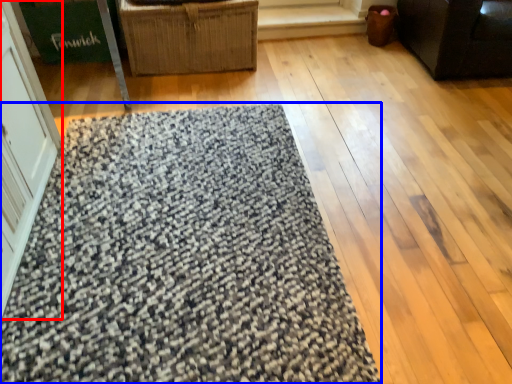
Question: Which point is closer to the camera, screen door (highlighted by a red box) or mat (highlighted by a blue box)?

Choices:
 (A) screen door
 (B) mat

Answer: (A)